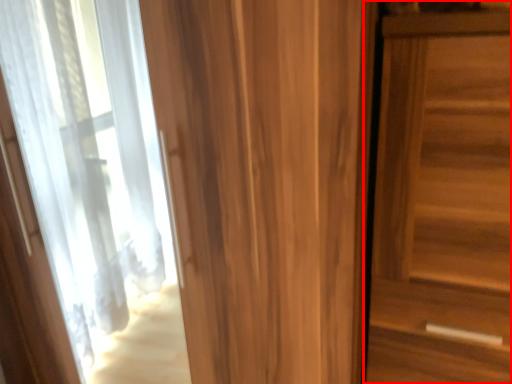
Question: Where is door (annotated by the red box) located in relation to door in the image?

Choices:
 (A) left
 (B) right

Answer: (B)